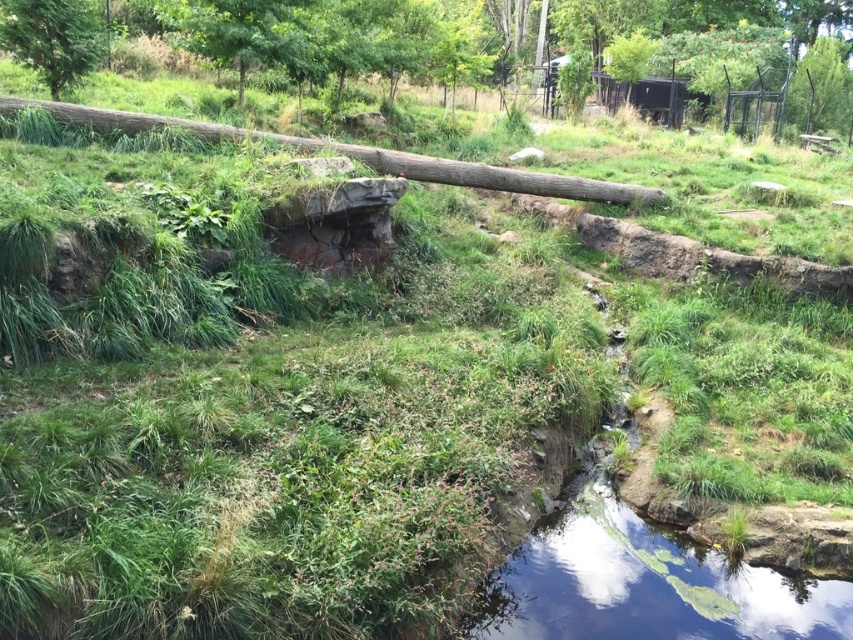
Question: Is green leafy tree at upper center bigger than brown rough log at center?

Choices:
 (A) yes
 (B) no

Answer: (A)

Question: Which point is farther to the camera?

Choices:
 (A) (786, 1)
 (B) (42, 22)
 (C) (413, 170)

Answer: (A)

Question: Can you confirm if brown rough log at center is positioned to the left of green matte tree at upper left?

Choices:
 (A) yes
 (B) no

Answer: (B)

Question: Is green leafy tree at upper center thinner than green matte tree at upper left?

Choices:
 (A) yes
 (B) no

Answer: (B)

Question: Among these objects, which one is nearest to the camera?

Choices:
 (A) green matte tree at upper left
 (B) green leafy tree at upper center
 (C) brown rough log at center

Answer: (C)

Question: Which object appears closest to the camera in this image?

Choices:
 (A) green matte tree at upper left
 (B) green leafy tree at upper center
 (C) brown rough log at center

Answer: (C)